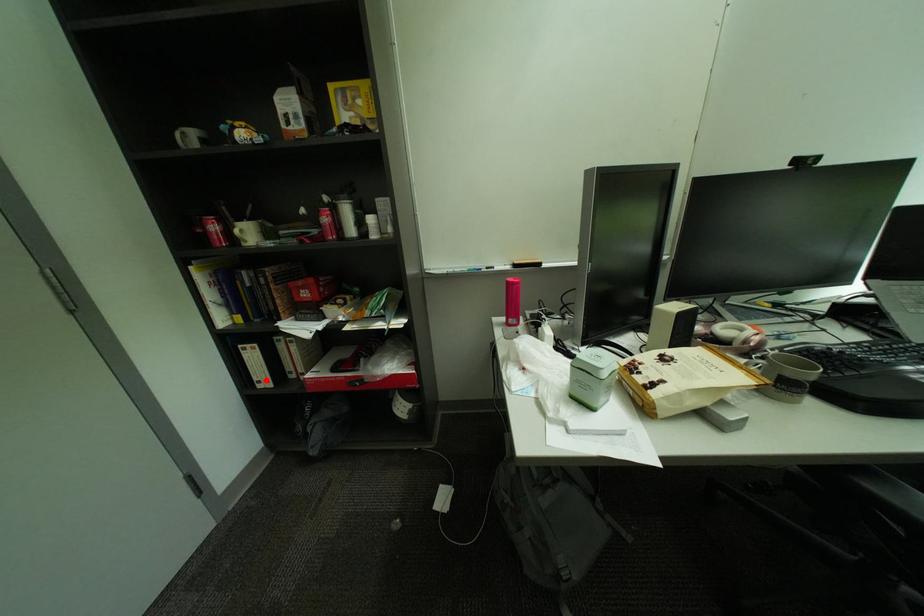
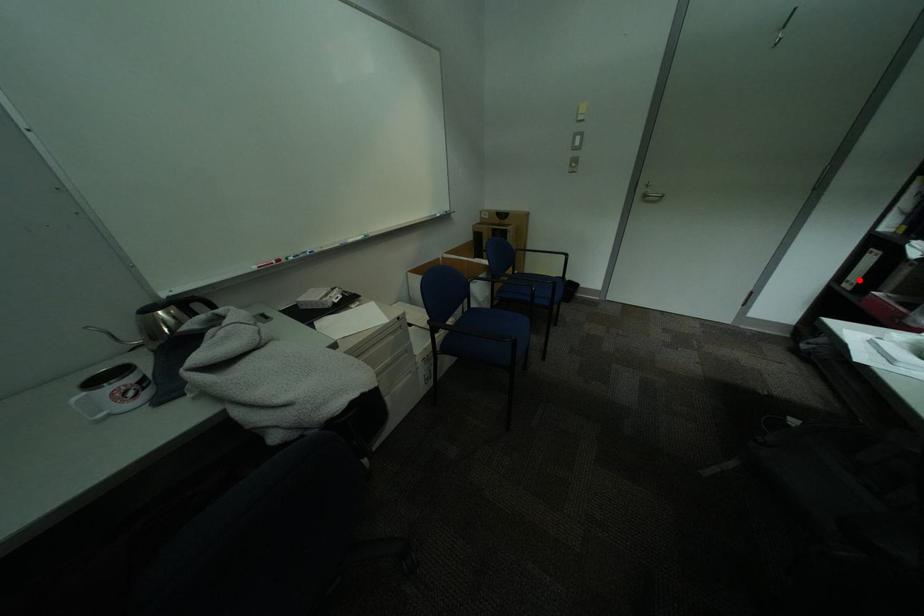
I am providing you with two images of the same scene from different viewpoints. A red point is marked on the first image and another point is marked on the second image. Do the highlighted points in image1 and image2 indicate the same real-world spot?

Yes